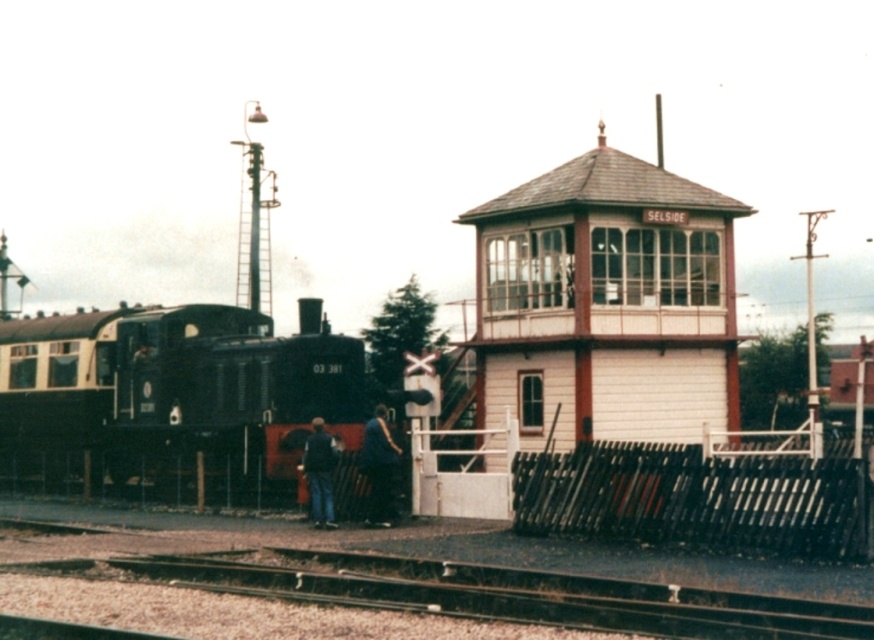
Question: Which point appears farthest from the camera in this image?

Choices:
 (A) (386, 522)
 (B) (167, 362)

Answer: (B)

Question: Which of these objects is positioned closest to the dark blue jeans at center?

Choices:
 (A) white wooden signal box at center
 (B) smooth metal tracks at center
 (C) dark blue shirt at center
 (D) matte black locomotive at left

Answer: (C)

Question: Is smooth metal tracks at center wider than dark blue jeans at center?

Choices:
 (A) no
 (B) yes

Answer: (B)

Question: From the image, what is the correct spatial relationship of smooth metal tracks at center in relation to dark blue shirt at center?

Choices:
 (A) above
 (B) below

Answer: (B)

Question: Does white wooden signal box at center have a greater width compared to matte black locomotive at left?

Choices:
 (A) no
 (B) yes

Answer: (B)

Question: Which point is closer to the camera taking this photo?

Choices:
 (A) (323, 467)
 (B) (576, 160)
 (C) (307, 380)

Answer: (A)